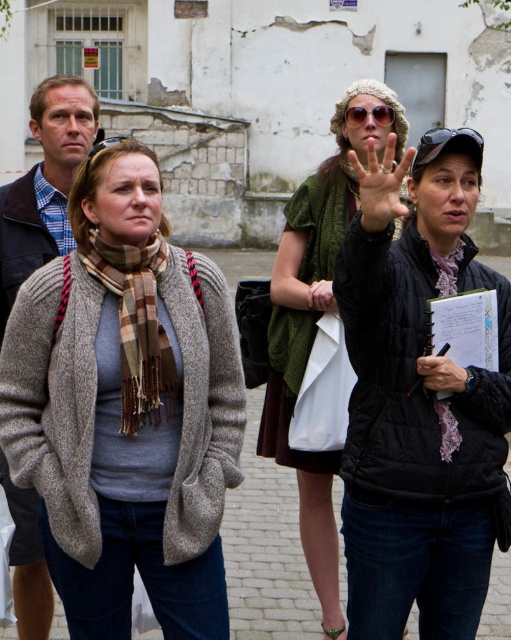
Between plaid wool scarf at center and matte green hand at center, which one has more height?

Standing taller between the two is plaid wool scarf at center.

Can you confirm if plaid wool scarf at center is taller than matte green hand at center?

Yes.

Is point (142, 413) behind point (383, 193)?

Yes.

Locate an element on the screen. The height and width of the screenshot is (640, 511). plaid wool scarf at center is located at coordinates (x=136, y=326).

Does plaid wool scarf at center lie in front of sunglasses at center?

Yes, plaid wool scarf at center is closer to the viewer.

Which is behind, point (113, 280) or point (360, 116)?

The point (360, 116) is more distant.

Who is more forward, (172,371) or (373,113)?

Point (172,371)

Locate an element on the screen. plaid wool scarf at center is located at coordinates (136, 326).

Is knitted green scarf at center to the right of matte green hand at center from the viewer's perspective?

Correct, you'll find knitted green scarf at center to the right of matte green hand at center.

Who is higher up, knitted green scarf at center or matte green hand at center?

matte green hand at center is above.

What do you see at coordinates (316, 326) in the screenshot? I see `knitted green scarf at center` at bounding box center [316, 326].

Locate an element on the screen. This screenshot has height=640, width=511. knitted green scarf at center is located at coordinates (316, 326).